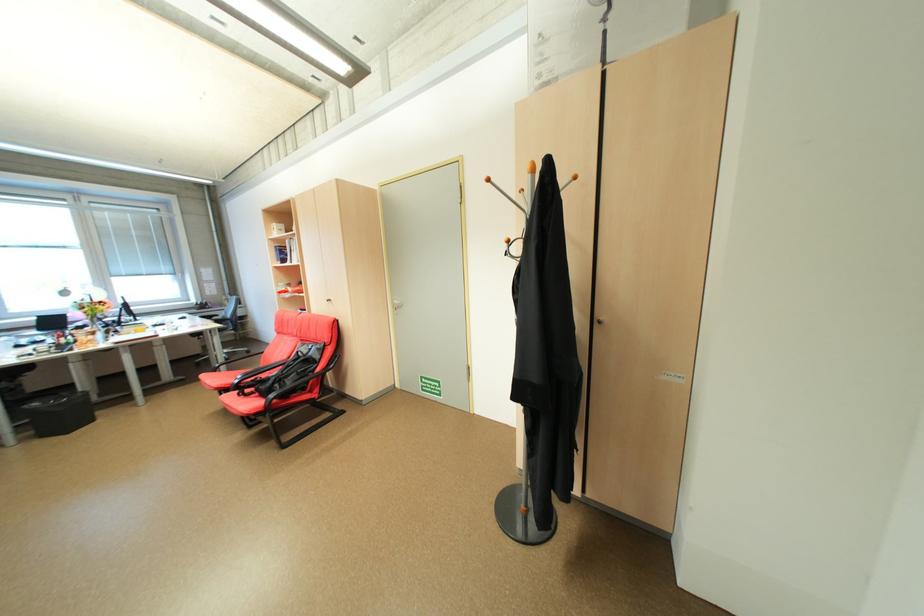
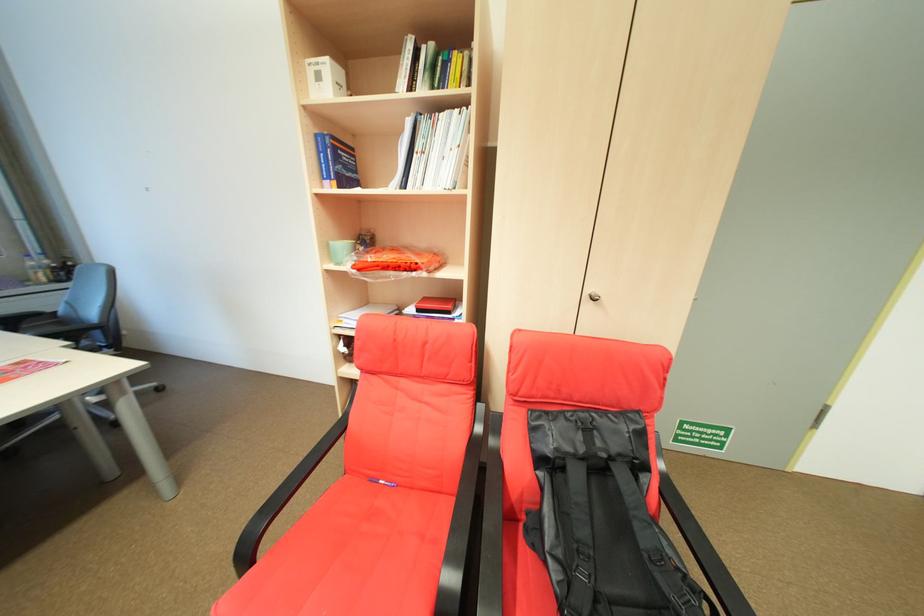
What movement of the cameraman would produce the second image?

The cameraman walked toward left, forward.